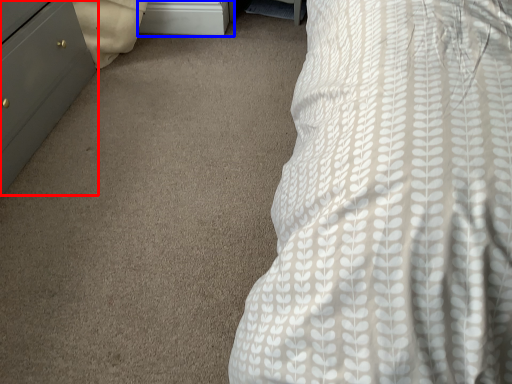
Question: Which object is further to the camera taking this photo, chest of drawers (highlighted by a red box) or file cabinet (highlighted by a blue box)?

Choices:
 (A) chest of drawers
 (B) file cabinet

Answer: (B)